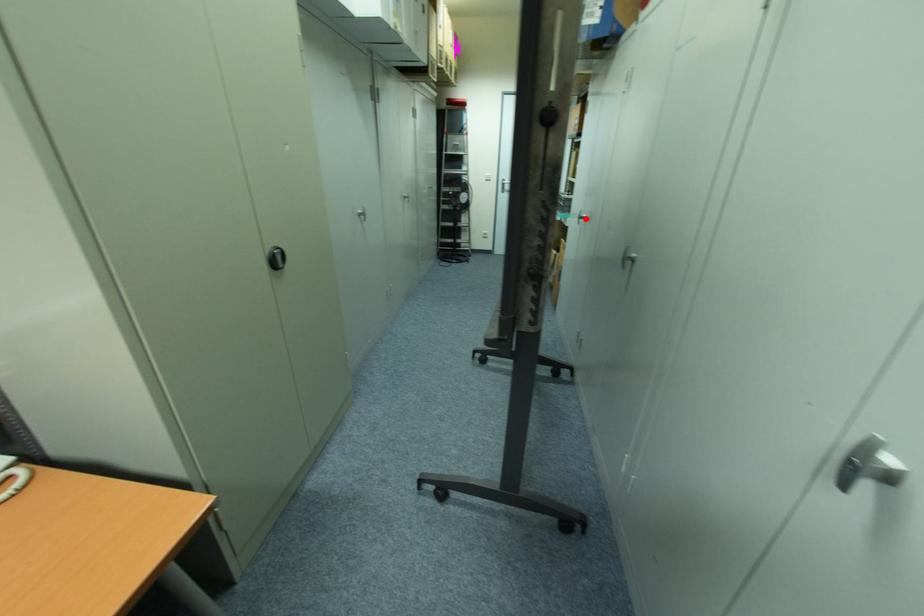
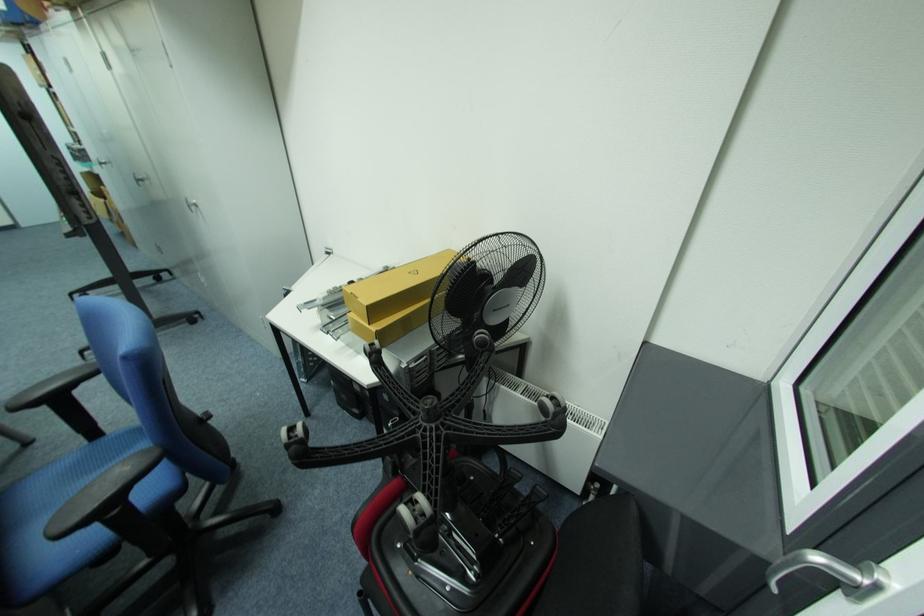
Question: A red point is marked in image1. In image2, is the corresponding 3D point closer to the camera or farther? Reply with the corresponding letter.

Choices:
 (A) The corresponding 3D point is closer.
 (B) The corresponding 3D point is farther.

Answer: (B)